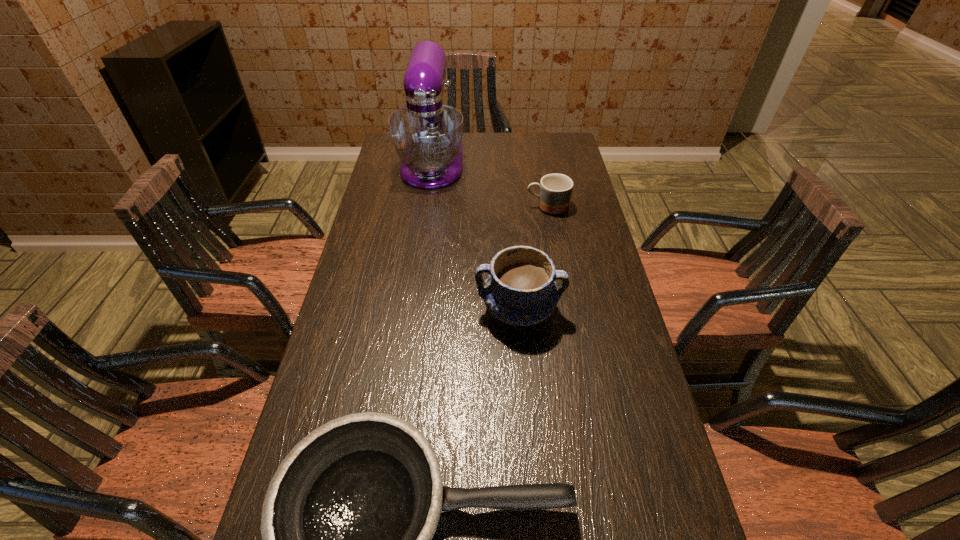
In order to click on vacant point at the far right corner in this screenshot , I will do tap(555, 162).

Locate an element on the screen. The image size is (960, 540). vacant area that lies between the farthest object and the third tallest object is located at coordinates (490, 186).

You are a GUI agent. You are given a task and a screenshot of the screen. Output one action in this format:
    pyautogui.click(x=<x>, y=<y>)
    Task: Click on the vacant area that lies between the pottery and the tallest object
    The width and height of the screenshot is (960, 540).
    Given the screenshot: What is the action you would take?
    pyautogui.click(x=475, y=238)

Locate an element on the screen. unoccupied position between the pottery and the tallest object is located at coordinates (475, 238).

Choose which object is the nearest neighbor to the frying pan. Please provide its 2D coordinates. Your answer should be formatted as a tuple, i.e. [(x, y)], where the tuple contains the x and y coordinates of a point satisfying the conditions above.

[(520, 290)]

The height and width of the screenshot is (540, 960). What are the coordinates of `object that is the second nearest to the mug` in the screenshot? It's located at (520, 290).

In order to click on vacant space that satisfies the following two spatial constraints: 1. at the bowl opening of the farthest object; 2. on the right side of the second nearest object in this screenshot , I will do `click(411, 310)`.

You are a GUI agent. You are given a task and a screenshot of the screen. Output one action in this format:
    pyautogui.click(x=<x>, y=<y>)
    Task: Click on the vacant space that satisfies the following two spatial constraints: 1. at the bowl opening of the second tallest object; 2. on the right side of the mixer
    The image size is (960, 540).
    Given the screenshot: What is the action you would take?
    pyautogui.click(x=411, y=310)

Where is `free location that satisfies the following two spatial constraints: 1. at the bowl opening of the pottery; 2. on the right side of the farthest object`? The width and height of the screenshot is (960, 540). free location that satisfies the following two spatial constraints: 1. at the bowl opening of the pottery; 2. on the right side of the farthest object is located at coordinates (411, 310).